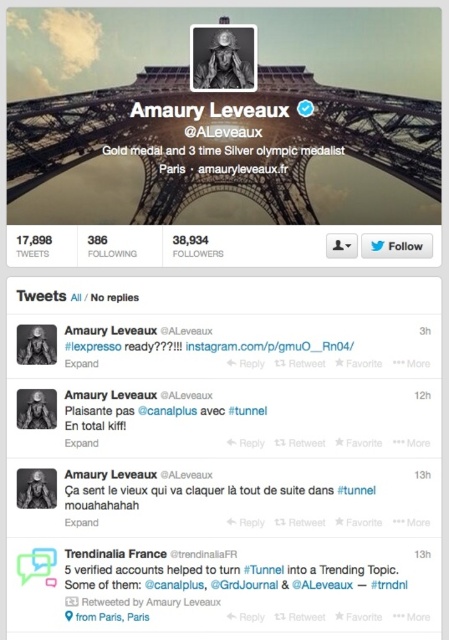
Question: Which point is closer to the camera taking this photo?

Choices:
 (A) (205, 44)
 (B) (206, 170)

Answer: (A)

Question: Does metallic structure at upper center appear on the left side of black matte portrait at upper center?

Choices:
 (A) no
 (B) yes

Answer: (B)

Question: Which point is farther to the camera?

Choices:
 (A) (164, 113)
 (B) (212, 36)

Answer: (B)

Question: Which point is farther to the camera?

Choices:
 (A) (325, 145)
 (B) (206, 29)

Answer: (B)

Question: Is metallic structure at upper center positioned in front of black matte portrait at upper center?

Choices:
 (A) yes
 (B) no

Answer: (A)

Question: Is metallic structure at upper center closer to camera compared to black matte portrait at upper center?

Choices:
 (A) no
 (B) yes

Answer: (B)